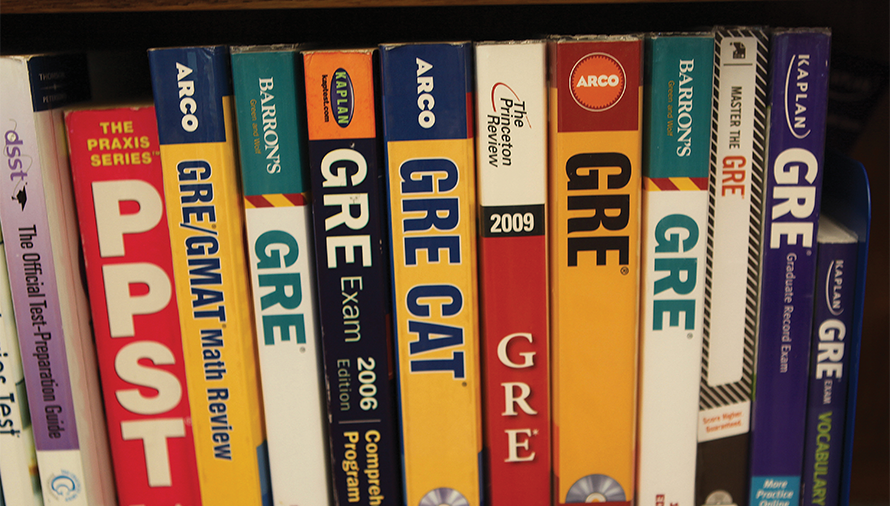
Identify the location of second book from left side of image. The width and height of the screenshot is (890, 506). (42, 359).